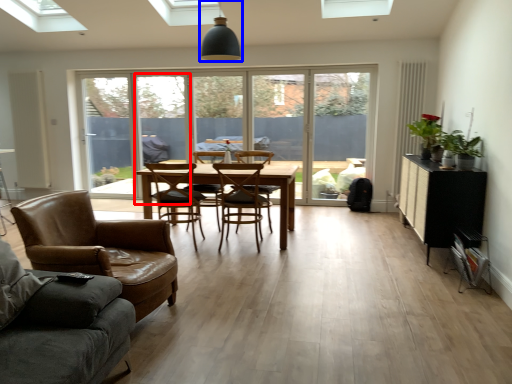
Question: Among these objects, which one is farthest to the camera, screen door (highlighted by a red box) or light fixture (highlighted by a blue box)?

Choices:
 (A) screen door
 (B) light fixture

Answer: (A)